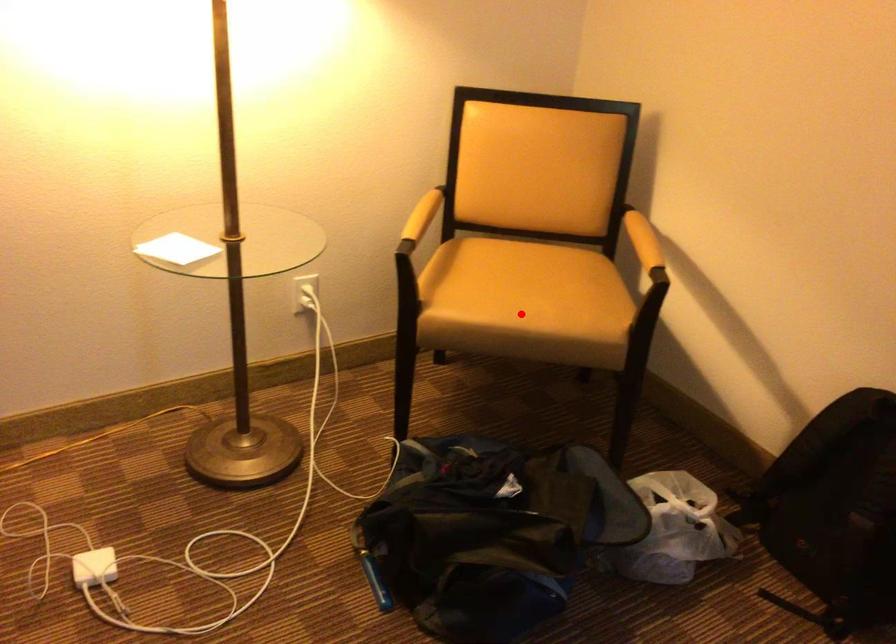
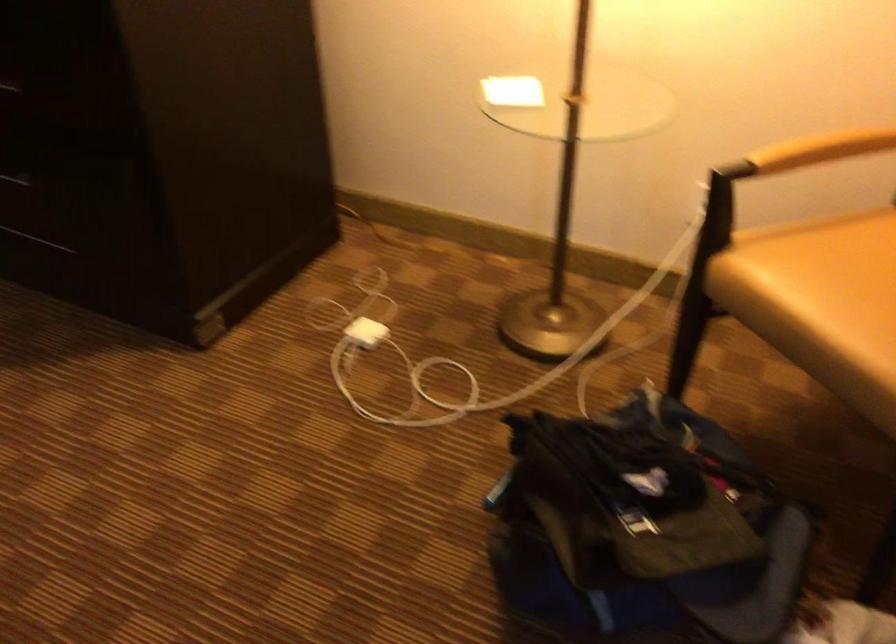
Locate, in the second image, the point that corresponds to the highlighted location in the first image.

(821, 303)